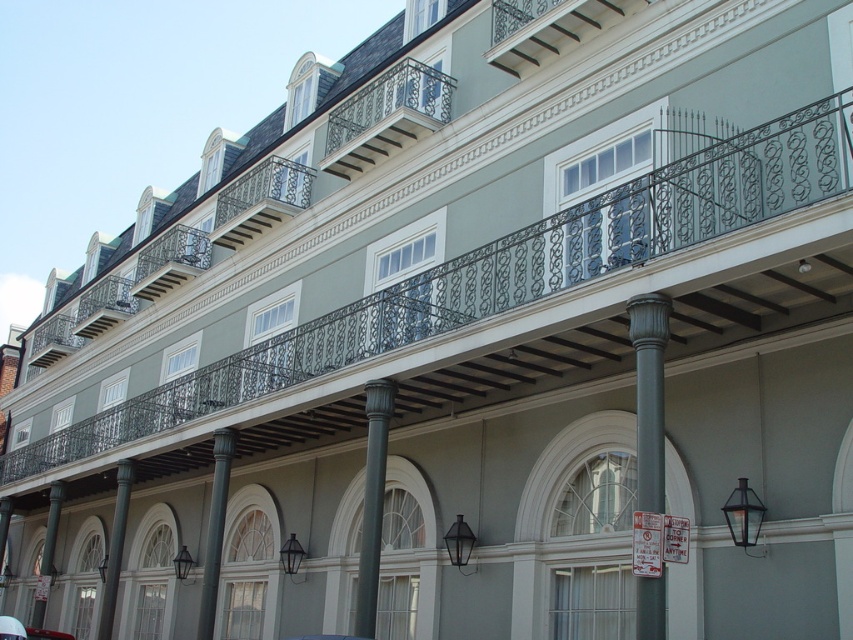
Question: From the image, what is the correct spatial relationship of black wrought iron balcony at upper center in relation to green polished stone column at center?

Choices:
 (A) right
 (B) left

Answer: (A)

Question: Considering the relative positions of black wrought iron balcony at center and green polished stone column at center in the image provided, where is black wrought iron balcony at center located with respect to green polished stone column at center?

Choices:
 (A) left
 (B) right

Answer: (B)

Question: In this image, where is smooth gray column at lower left located relative to green polished stone column at center?

Choices:
 (A) right
 (B) left

Answer: (A)

Question: Which point is farther from the camera taking this photo?

Choices:
 (A) (645, 451)
 (B) (41, 609)

Answer: (B)

Question: Which is nearer to the green polished stone column at center?

Choices:
 (A) green polished wood column at center
 (B) black wrought iron balcony at upper center

Answer: (A)

Question: Which object appears closest to the camera in this image?

Choices:
 (A) green polished wood column at center
 (B) shiny red car at lower left
 (C) black wrought iron balcony at center
 (D) smooth gray column at lower left

Answer: (A)